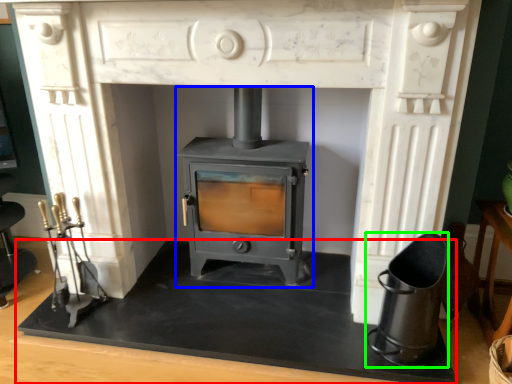
Question: Which object is positioned closest to slate (highlighted by a red box)? Select from wood burning stove (highlighted by a blue box) and appliance (highlighted by a green box).

Choices:
 (A) wood burning stove
 (B) appliance

Answer: (A)